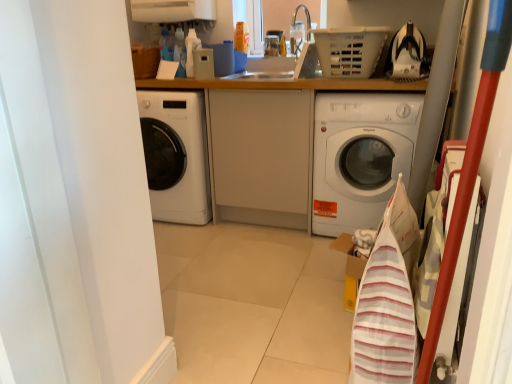
Where is `white plastic basket at upper center`? white plastic basket at upper center is located at coordinates (350, 50).

Describe the element at coordinates (350, 50) in the screenshot. This screenshot has width=512, height=384. I see `white plastic basket at upper center` at that location.

Measure the distance between white glossy washing machine at center and camera.

A distance of 2.06 meters exists between white glossy washing machine at center and camera.

This screenshot has height=384, width=512. What do you see at coordinates (360, 156) in the screenshot?
I see `white glossy washing machine at center` at bounding box center [360, 156].

What is the approximate height of white glossy washing machine at center?

33.97 inches.

Identify the location of white glossy washing machine at center. The image size is (512, 384). (360, 156).

Locate an element on the screen. white plastic basket at upper center is located at coordinates (350, 50).

Which is more to the left, white plastic basket at upper center or white glossy washing machine at center?

white plastic basket at upper center is more to the left.

Consider the image. Is the depth of white plastic basket at upper center greater than that of white glossy washing machine at center?

That is False.

Considering the positions of points (362, 27) and (411, 159), is point (362, 27) farther from camera compared to point (411, 159)?

That is True.

From the image's perspective, relative to white glossy washing machine at center, is white plastic basket at upper center above or below?

white plastic basket at upper center is above white glossy washing machine at center.

From a real-world perspective, relative to white glossy washing machine at center, is white plastic basket at upper center vertically above or below?

white plastic basket at upper center is situated higher than white glossy washing machine at center in the real world.

Between white plastic basket at upper center and white glossy washing machine at center, which one has smaller width?

white glossy washing machine at center.

Who is taller, white plastic basket at upper center or white glossy washing machine at center?

Standing taller between the two is white glossy washing machine at center.

In the scene shown: Who is smaller, white plastic basket at upper center or white glossy washing machine at center?

white plastic basket at upper center is smaller.

Is white glossy washing machine at center a part of white plastic basket at upper center?

That's incorrect, white glossy washing machine at center is not inside white plastic basket at upper center.

Is white plastic basket at upper center not close to white glossy washing machine at center?

white plastic basket at upper center is actually quite close to white glossy washing machine at center.

Is white plastic basket at upper center facing towards white glossy washing machine at center?

No, white plastic basket at upper center is not oriented towards white glossy washing machine at center.

How different are the orientations of white plastic basket at upper center and white glossy washing machine at center in degrees?

0.593 degrees.

Where is `basket lying on the left of white glossy washing machine at center`? basket lying on the left of white glossy washing machine at center is located at coordinates (350, 50).

Based on the photo, considering the relative positions of white glossy washing machine at center and white plastic basket at upper center in the image provided, is white glossy washing machine at center to the right of white plastic basket at upper center from the viewer's perspective?

Yes, white glossy washing machine at center is to the right of white plastic basket at upper center.

Is white glossy washing machine at center positioned behind white plastic basket at upper center?

Yes, it is behind white plastic basket at upper center.

Is point (324, 223) farther from camera compared to point (345, 36)?

That is True.

From the image's perspective, does white glossy washing machine at center appear higher than white plastic basket at upper center?

Incorrect, from the image's perspective, white glossy washing machine at center is lower than white plastic basket at upper center.

From a real-world perspective, is white glossy washing machine at center on top of white plastic basket at upper center?

No.

Is white glossy washing machine at center wider or thinner than white plastic basket at upper center?

Considering their sizes, white glossy washing machine at center looks slimmer than white plastic basket at upper center.

Can you confirm if white glossy washing machine at center is taller than white plastic basket at upper center?

Yes, white glossy washing machine at center is taller than white plastic basket at upper center.

Which of these two, white glossy washing machine at center or white plastic basket at upper center, is smaller?

white plastic basket at upper center is smaller.

Is white plastic basket at upper center completely or partially inside white glossy washing machine at center?

No, white plastic basket at upper center is not inside white glossy washing machine at center.

Is white glossy washing machine at center next to white plastic basket at upper center?

No, white glossy washing machine at center is not in contact with white plastic basket at upper center.

Is white glossy washing machine at center oriented towards white plastic basket at upper center?

No.

Can you tell me how much white glossy washing machine at center and white plastic basket at upper center differ in facing direction?

There is a 0.593-degree angle between the facing directions of white glossy washing machine at center and white plastic basket at upper center.

At what (x,y) coordinates should I click in order to perform the action: click on washing machine behind the white plastic basket at upper center. Please return your answer as a coordinate pair (x, y). This screenshot has width=512, height=384. Looking at the image, I should click on (360, 156).

At what (x,y) coordinates should I click in order to perform the action: click on basket above the white glossy washing machine at center (from the image's perspective). Please return your answer as a coordinate pair (x, y). The width and height of the screenshot is (512, 384). Looking at the image, I should click on (350, 50).

The image size is (512, 384). I want to click on washing machine that is on the right side of white plastic basket at upper center, so click(360, 156).